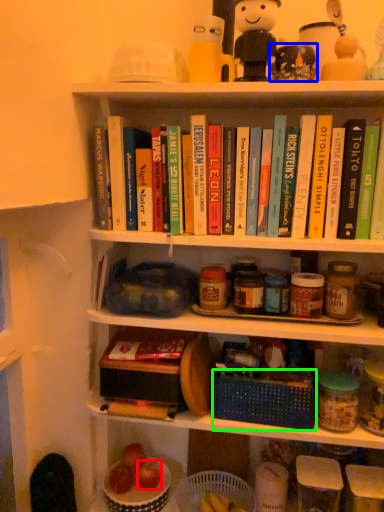
Question: Which object is the closest to the apple (highlighted by a red box)? Choose among these: toy (highlighted by a blue box) or basket (highlighted by a green box).

Choices:
 (A) toy
 (B) basket

Answer: (B)